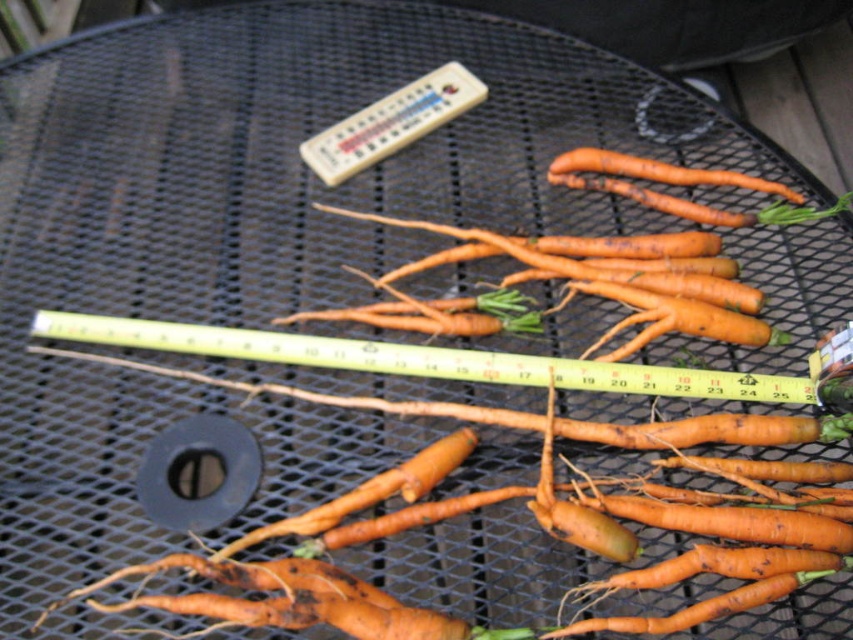
You are standing at the position of the viewer looking at the carrots on the black metal mesh table. There is a point marked at coordinates (413, 358) on the table. If you want to place a carrot exactly 30 inches away from this point, will it fit within the table? The table is as long as the measuring tape shown.

The point at (413, 358) is 32.15 inches away from the viewer. To place a carrot 30 inches from this point, it would be within the 32.15 inches distance, so yes, it would fit within the table since the table is as long as the measuring tape which goes up to 25 inches. Wait, the measuring tape goes up to 25 inches, but the distance from the viewer to the point is 32.15 inches. This indicates a discrepancy. The table length according to the tape is 25 inches, but the point is already beyond that. Therefore,

You are a farmer inspecting carrots on a table. You see an orange matte carrot at center and an orange rough skin at upper center. Which carrot has a taller height?

The orange matte carrot at center has a greater height compared to the orange rough skin at upper center.